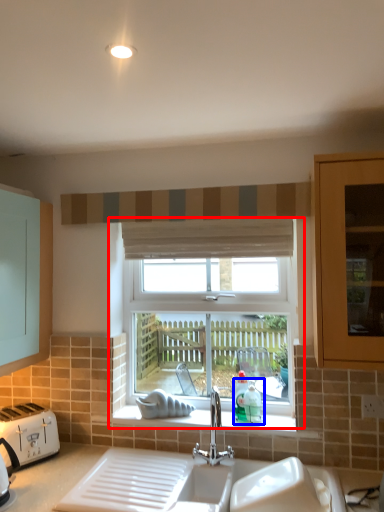
Question: Which point is closer to the camera, window (highlighted by a red box) or teal (highlighted by a blue box)?

Choices:
 (A) window
 (B) teal

Answer: (B)